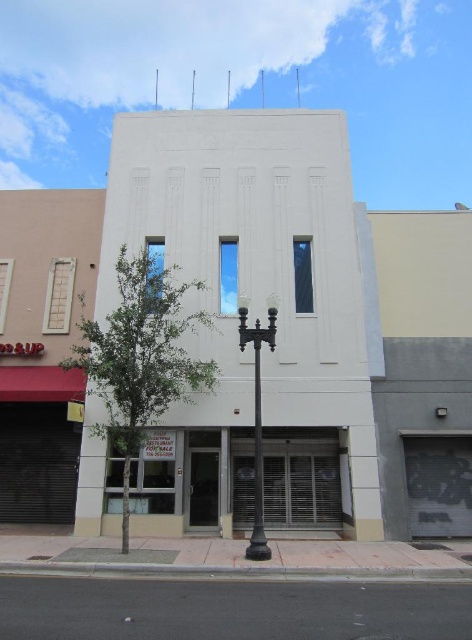
Question: Is metallic silver storefront at center thinner than black metal pole at center?

Choices:
 (A) no
 (B) yes

Answer: (A)

Question: Can you confirm if metallic silver storefront at center is smaller than black metal pole at center?

Choices:
 (A) no
 (B) yes

Answer: (B)

Question: Can you confirm if polished bronze streetlight at center is smaller than black metal pole at center?

Choices:
 (A) no
 (B) yes

Answer: (B)

Question: Which is farther from the polished bronze streetlight at center?

Choices:
 (A) black metal pole at center
 (B) metallic silver storefront at center

Answer: (B)

Question: Which point is closer to the camera?

Choices:
 (A) (254, 435)
 (B) (247, 550)

Answer: (B)

Question: Among these points, which one is farthest from the camera?

Choices:
 (A) (256, 353)
 (B) (261, 532)
 (C) (337, 460)

Answer: (C)